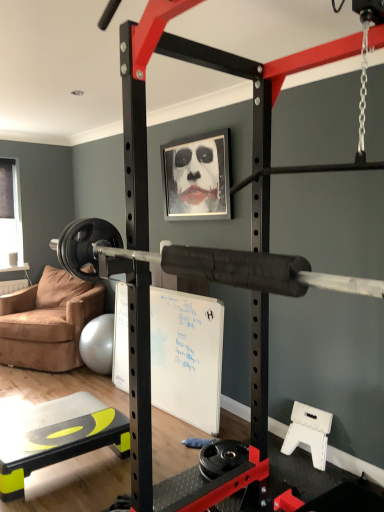
Question: Considering the positions of point (26, 470) and point (165, 202), is point (26, 470) closer or farther from the camera than point (165, 202)?

Choices:
 (A) farther
 (B) closer

Answer: (B)

Question: Is yellow-green plastic step at lower left spatially inside metallic silver picture frame at upper center, or outside of it?

Choices:
 (A) inside
 (B) outside

Answer: (B)

Question: Based on their relative distances, which object is nearer to the metallic silver picture frame at upper center?

Choices:
 (A) transparent plastic window screen at left
 (B) brown suede chair at left
 (C) yellow-green plastic step at lower left

Answer: (B)

Question: Estimate the real-world distances between objects in this image. Which object is farther from the metallic silver picture frame at upper center?

Choices:
 (A) yellow-green plastic step at lower left
 (B) transparent plastic window screen at left
 (C) brown suede chair at left

Answer: (B)